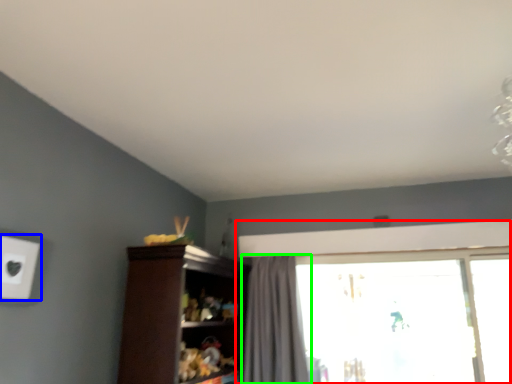
Question: Considering the real-world distances, which object is closest to window (highlighted by a red box)? electric outlet (highlighted by a blue box) or curtain (highlighted by a green box).

Choices:
 (A) electric outlet
 (B) curtain

Answer: (B)